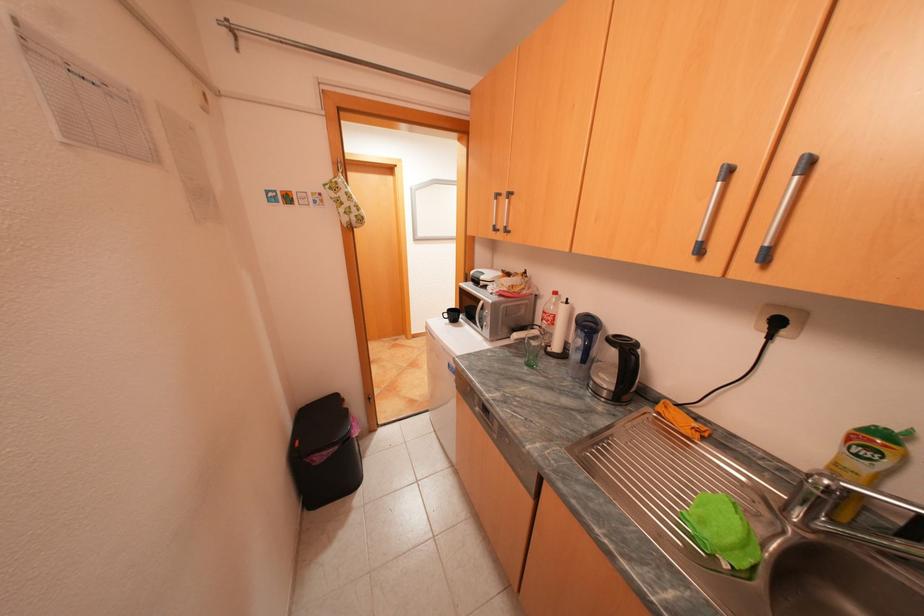
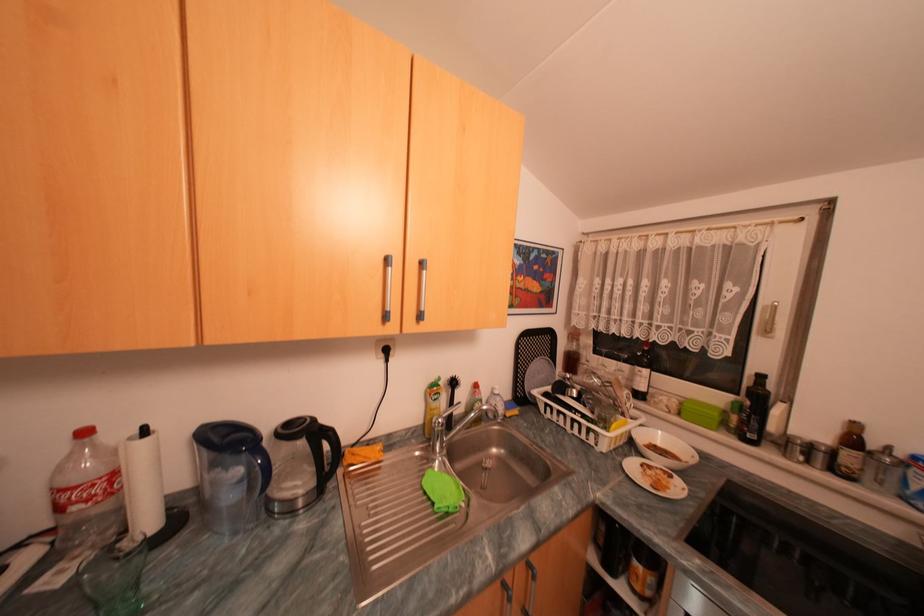
In the second image, find the point that corresponds to [565,293] in the first image.

(94, 432)